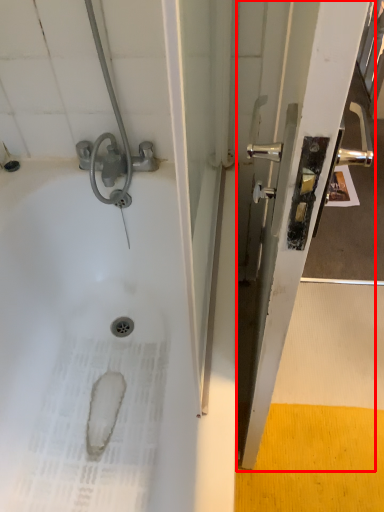
Question: Observing the image, what is the correct spatial positioning of screen door (annotated by the red box) in reference to bath?

Choices:
 (A) left
 (B) right

Answer: (B)